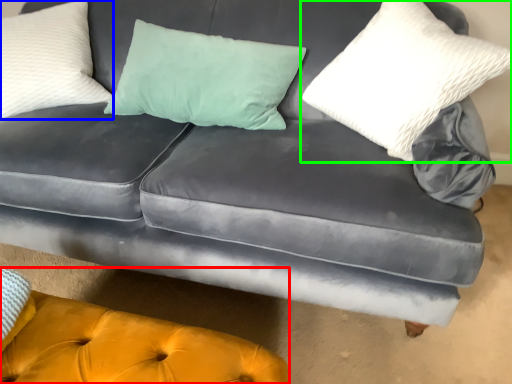
Question: Which is farther away from couch (highlighted by a red box)? pillow (highlighted by a blue box) or pillow (highlighted by a green box)?

Choices:
 (A) pillow
 (B) pillow

Answer: (A)